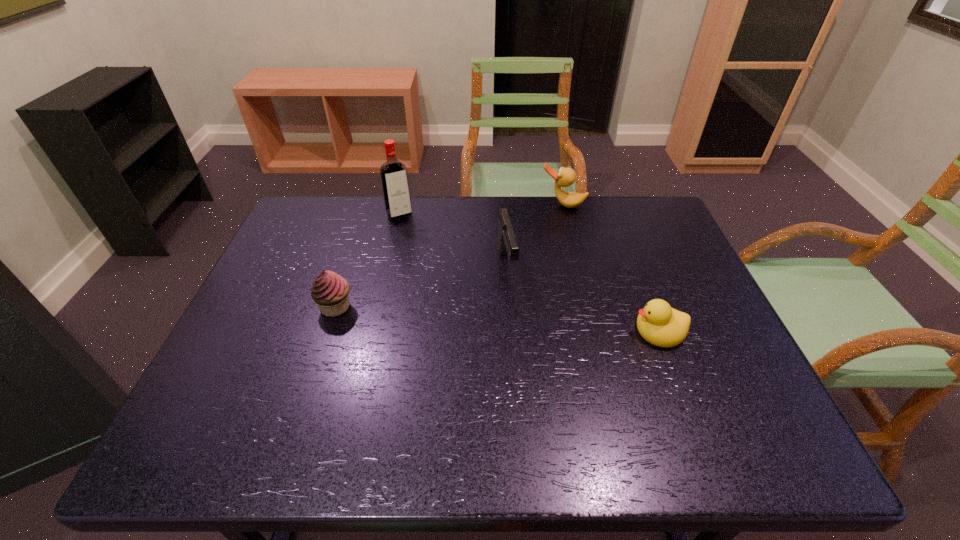
This screenshot has height=540, width=960. Find the location of `free space located 0.320m aim along the barrel of the pistol`. free space located 0.320m aim along the barrel of the pistol is located at coordinates (537, 391).

I want to click on vodka situated at the far edge, so click(394, 178).

The height and width of the screenshot is (540, 960). I want to click on duck at the far edge, so click(565, 177).

Identify the location of object at the right edge. (659, 324).

Where is `free space at the far edge of the desktop`? free space at the far edge of the desktop is located at coordinates (460, 211).

This screenshot has height=540, width=960. What are the coordinates of `blank space at the near edge of the desktop` in the screenshot? It's located at (564, 399).

The width and height of the screenshot is (960, 540). In order to click on vacant space at the right edge of the desktop in this screenshot , I will do `click(711, 322)`.

In the image, there is a desktop. In order to click on vacant space at the far left corner in this screenshot , I will do `click(309, 218)`.

Where is `free region at the far right corner of the desktop`? free region at the far right corner of the desktop is located at coordinates (635, 235).

Locate an element on the screen. The height and width of the screenshot is (540, 960). empty space that is in between the leftmost object and the second object from right to left is located at coordinates (449, 256).